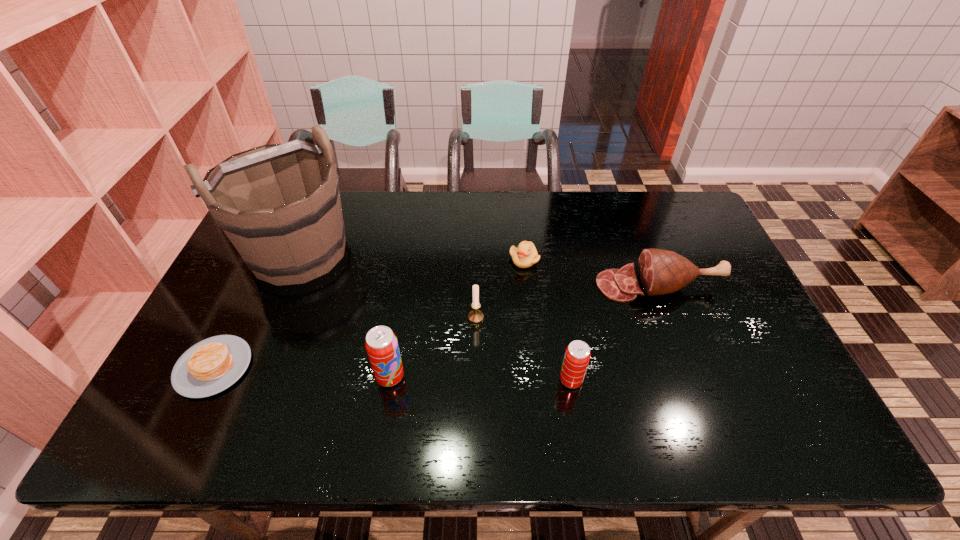
Find the location of `free space at the far right corner`. free space at the far right corner is located at coordinates (674, 230).

At what (x,y) coordinates should I click in order to perform the action: click on vacant space that is in between the shorter soda can and the second shortest object. Please return your answer as a coordinate pair (x, y). This screenshot has width=960, height=540. Looking at the image, I should click on tap(547, 320).

In order to click on vacant region between the left soda can and the rightmost object in this screenshot , I will do `click(524, 331)`.

Where is `free space between the tallest object and the sixth tallest object`? The width and height of the screenshot is (960, 540). free space between the tallest object and the sixth tallest object is located at coordinates (412, 256).

The height and width of the screenshot is (540, 960). In order to click on free area in between the candle holder and the tallest object in this screenshot , I will do `click(387, 285)`.

The height and width of the screenshot is (540, 960). What are the coordinates of `free space between the bucket and the sixth tallest object` in the screenshot? It's located at (412, 256).

The image size is (960, 540). I want to click on free space between the fifth object from right to left and the fourth object from left to right, so click(x=433, y=347).

Find the location of a particular element. Image resolution: width=960 pixels, height=540 pixels. vacant space in between the second tallest object and the pancake is located at coordinates tap(301, 372).

The image size is (960, 540). Find the location of `vacant point located between the fifth object from left to right and the bucket`. vacant point located between the fifth object from left to right and the bucket is located at coordinates (412, 256).

Find the location of a particular element. The image size is (960, 540). vacant space in between the bucket and the ham is located at coordinates (479, 268).